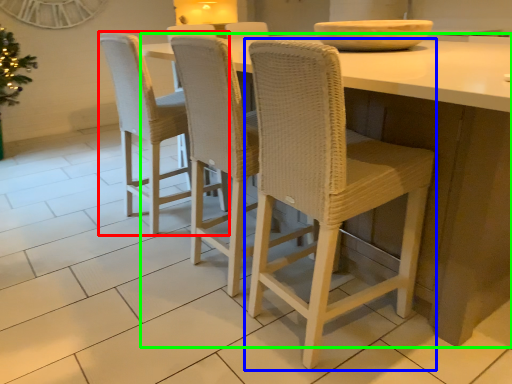
Question: Which is farther away from chair (highlighted by a red box)? chair (highlighted by a blue box) or table (highlighted by a green box)?

Choices:
 (A) chair
 (B) table

Answer: (B)